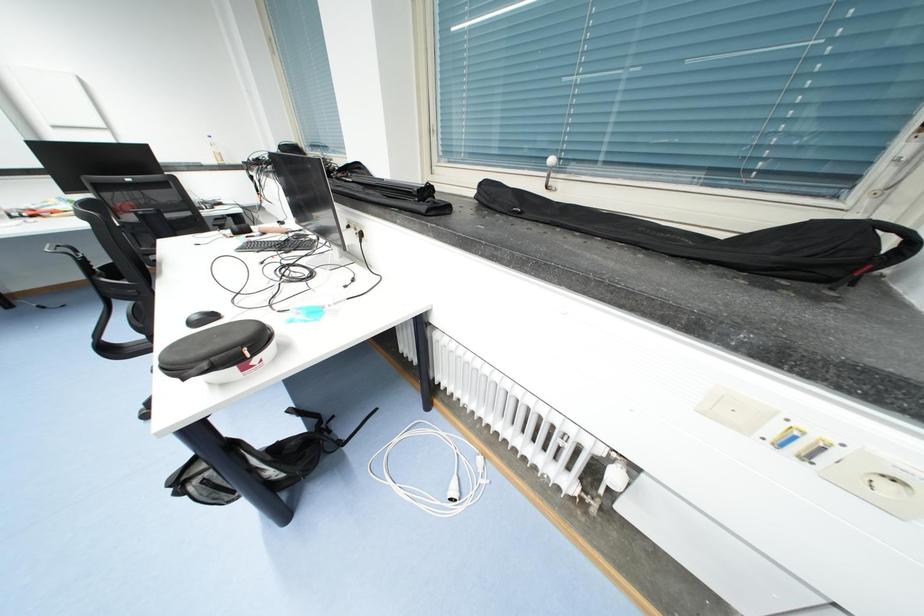
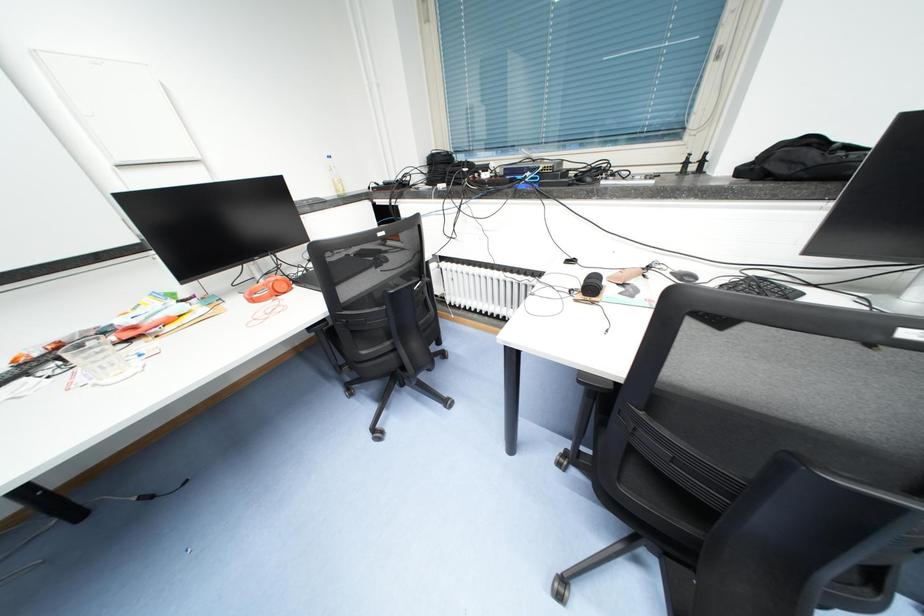
What movement of the cameraman would produce the second image?

The cameraman moved toward left, forward.